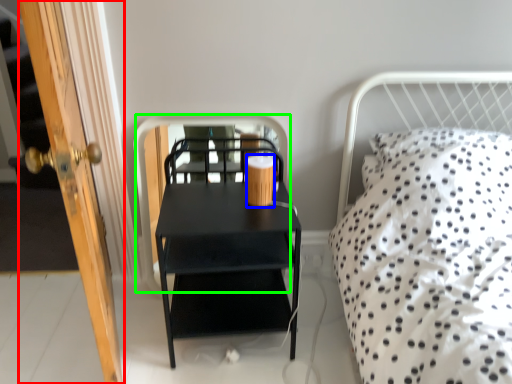
Question: Which object is the farthest from door (highlighted by a red box)? Choose among these: coffee cup (highlighted by a blue box) or screen door (highlighted by a green box).

Choices:
 (A) coffee cup
 (B) screen door

Answer: (B)